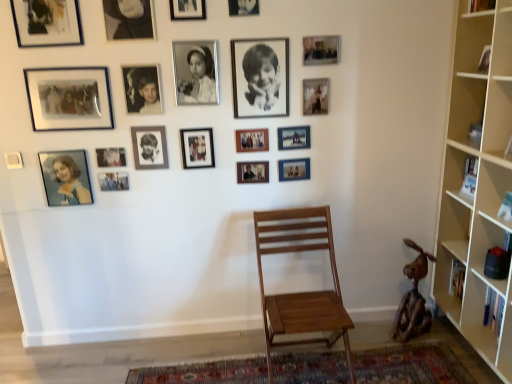
At what (x,y) coordinates should I click in order to perform the action: click on vacant space situated on the left part of rustic wood sculpture at lower right. Please return your answer as a coordinate pair (x, y). This screenshot has height=384, width=512. Looking at the image, I should click on (368, 334).